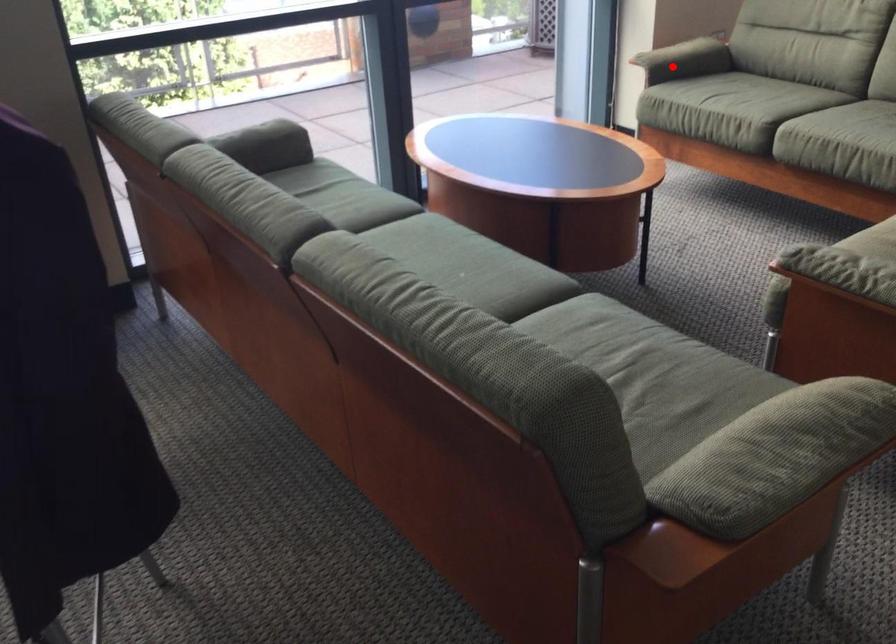
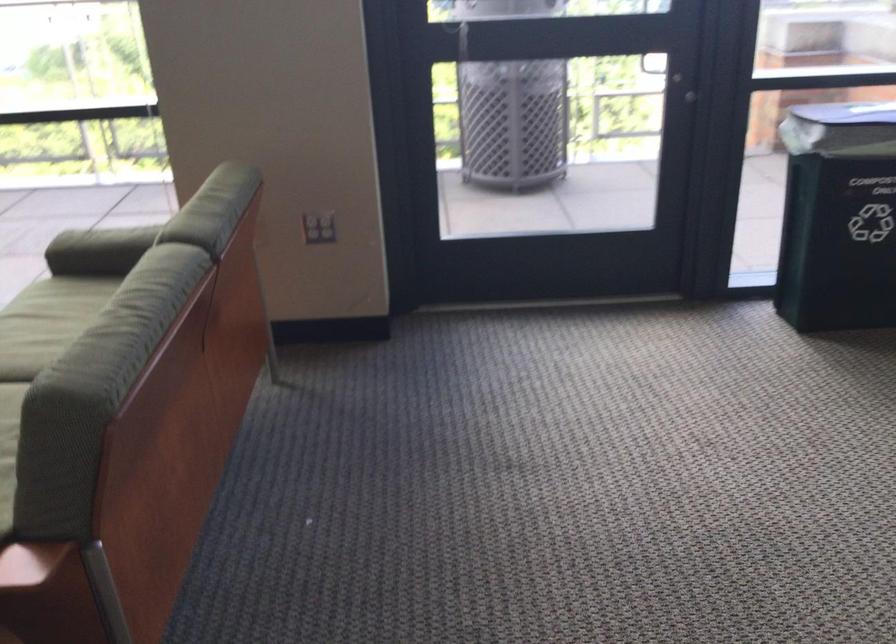
Question: I am providing you with two images of the same scene from different viewpoints. A red point is shown in image1. For the corresponding object point in image2, is it positioned nearer or farther from the camera?

Choices:
 (A) Nearer
 (B) Farther

Answer: (A)